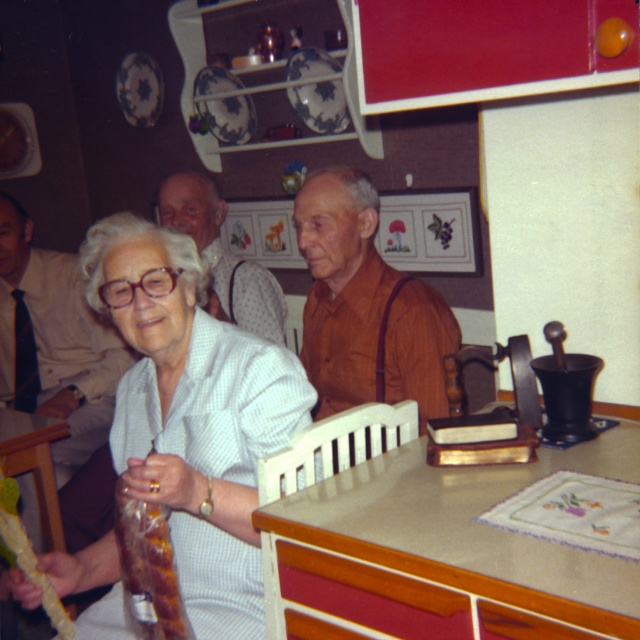
You are a guest at this gathering and want to place a small gift on the beige laminate table at center. However, you notice the white textured shirt at center might be in the way. Can you place the gift on the table without disturbing the shirt?

The beige laminate table at center is shorter than white textured shirt at center, so the shirt is taller than the table. This means the shirt might block access to the table, making it difficult to place the gift without moving the shirt.

You are taking a photo of the scene and want to focus on both point (35, 396) and point (218, 227). Which point should you focus on first to ensure both are in sharp focus?

You should focus on point (35, 396) first because it is closer to the camera than point (218, 227), ensuring both are within the depth of field.

You are a photographer standing in front of the scene. You need to adjust your camera to focus on both the white shirt at upper left and the brown leather jacket at upper center. Which one should you focus on first to ensure the other is also in focus?

The white shirt at upper left is much taller than the brown leather jacket at upper center, so you should focus on the white shirt at upper left first to ensure the brown leather jacket at upper center is also in focus.